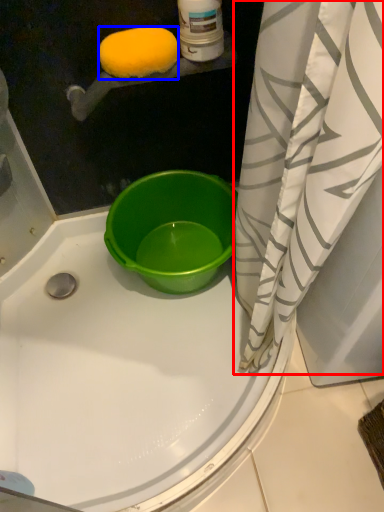
Question: Which of the following is the closest to the observer, curtain (highlighted by a red box) or lemon (highlighted by a blue box)?

Choices:
 (A) curtain
 (B) lemon

Answer: (A)